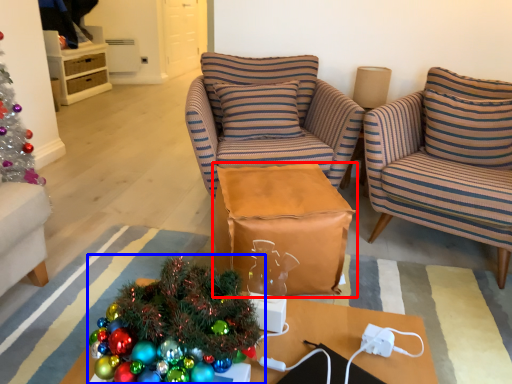
Question: Which object appears farthest to the camera in this image, table (highlighted by a red box) or christmas tree (highlighted by a blue box)?

Choices:
 (A) table
 (B) christmas tree

Answer: (A)